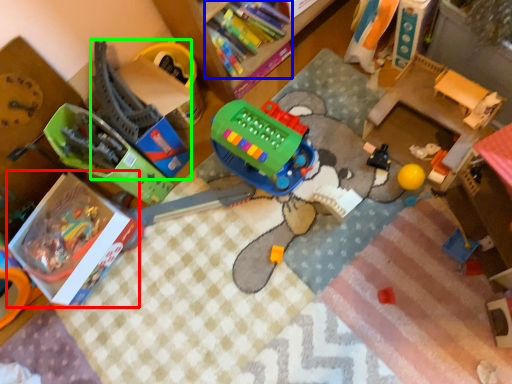
Question: Which is farther away from box (highlighted by a red box)? book (highlighted by a blue box) or toy (highlighted by a green box)?

Choices:
 (A) book
 (B) toy

Answer: (A)